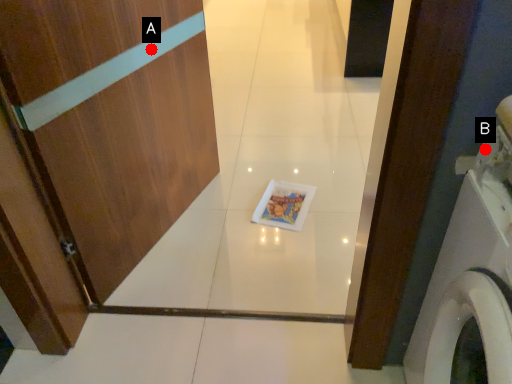
Question: Two points are circled on the image, labeled by A and B beside each circle. Which point is further to the camera?

Choices:
 (A) A is further
 (B) B is further

Answer: (A)